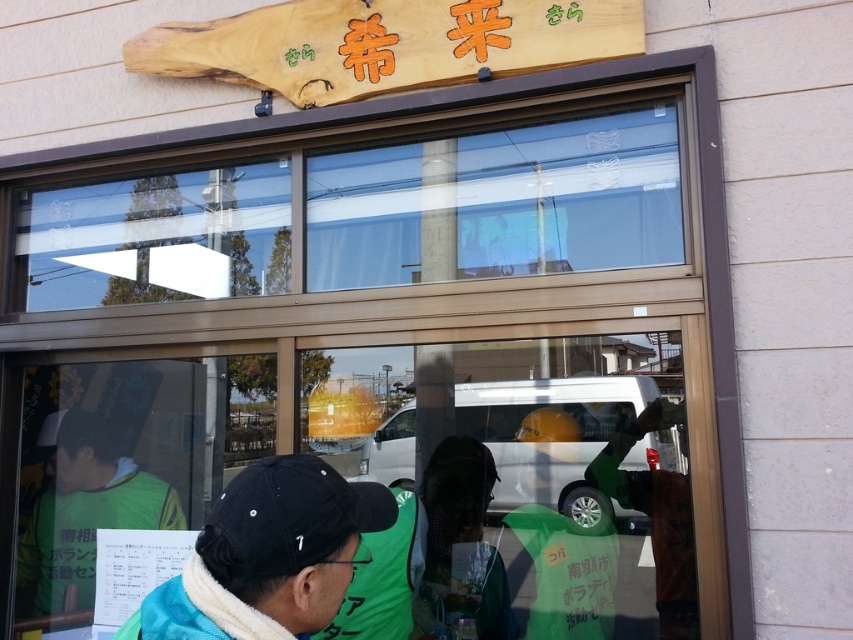
You are standing at the entrance of the building and want to check if the transparent glass window at center is visible from your current position. Based on the scene description, can you confirm if the window is visible?

Yes, the transparent glass window at center is visible as it is described as being at the entrance with reflections of external elements like a white van, trees, and sky, indicating it is facing outward and clear enough to reflect those objects.

You are a customer entering the shop and notice two items in the reflection of the glass window. The items are the green fabric vest at lower left and the black matte baseball cap at center. Which of these items appears taller in the reflection?

The green fabric vest at lower left appears much taller than the black matte baseball cap at center in the reflection.